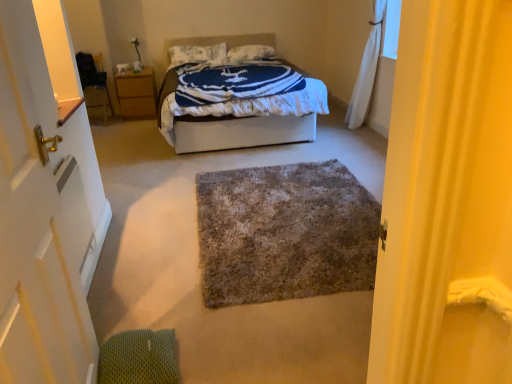
Question: In terms of size, does shaggy gray rug at center appear bigger or smaller than white sheer curtain at upper right?

Choices:
 (A) small
 (B) big

Answer: (A)

Question: From a real-world perspective, is shaggy gray rug at center positioned above or below white sheer curtain at upper right?

Choices:
 (A) below
 (B) above

Answer: (A)

Question: Which is nearer to the shaggy gray rug at center?

Choices:
 (A) white soft pillow at center, the second pillow viewed from the left
 (B) white wooden door at left
 (C) wooden nightstand at left
 (D) white fabric bed at center
 (E) white sheer curtain at upper right

Answer: (B)

Question: Which of these objects is positioned closest to the wooden nightstand at left?

Choices:
 (A) white wooden door at left
 (B) white soft pillow at center, which is the 1th pillow from right to left
 (C) white fabric bed at center
 (D) white sheer curtain at upper right
 (E) shaggy gray rug at center

Answer: (B)